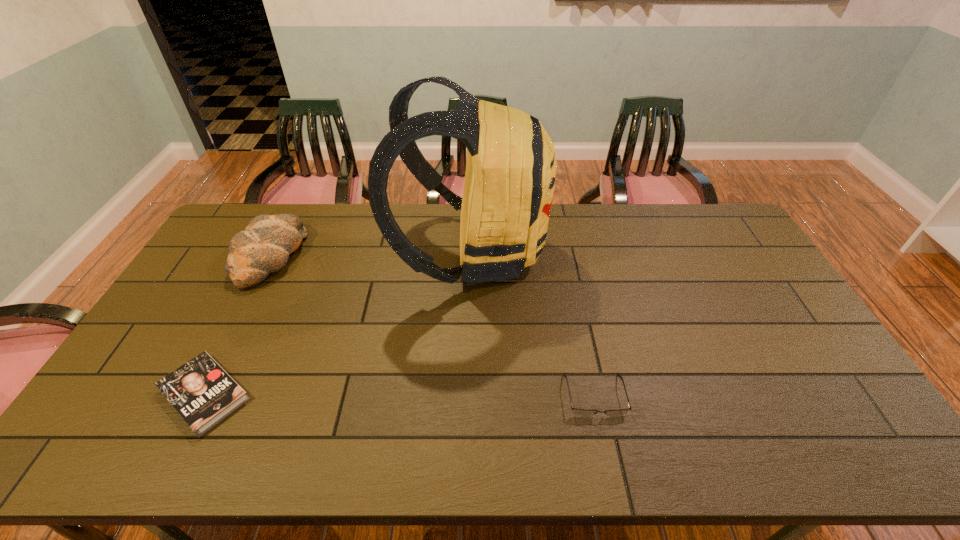
Where is `object at the near edge`? The height and width of the screenshot is (540, 960). object at the near edge is located at coordinates (201, 391).

The image size is (960, 540). I want to click on bread present at the left edge, so click(264, 247).

I want to click on book at the left edge, so click(x=201, y=391).

At what (x,y) coordinates should I click in order to perform the action: click on object located at the far left corner. Please return your answer as a coordinate pair (x, y). This screenshot has height=540, width=960. Looking at the image, I should click on click(264, 247).

Locate an element on the screen. This screenshot has height=540, width=960. object situated at the near left corner is located at coordinates pyautogui.click(x=201, y=391).

Where is `vacant area at the far edge`? vacant area at the far edge is located at coordinates (328, 239).

Locate an element on the screen. The image size is (960, 540). free space at the near edge is located at coordinates pyautogui.click(x=283, y=462).

In the image, there is a desktop. What are the coordinates of `vacant space at the left edge` in the screenshot? It's located at (209, 275).

Find the location of a particular element. This screenshot has width=960, height=540. vacant space at the near left corner of the desktop is located at coordinates click(107, 454).

The height and width of the screenshot is (540, 960). What are the coordinates of `vacant space at the far right corner` in the screenshot? It's located at (688, 206).